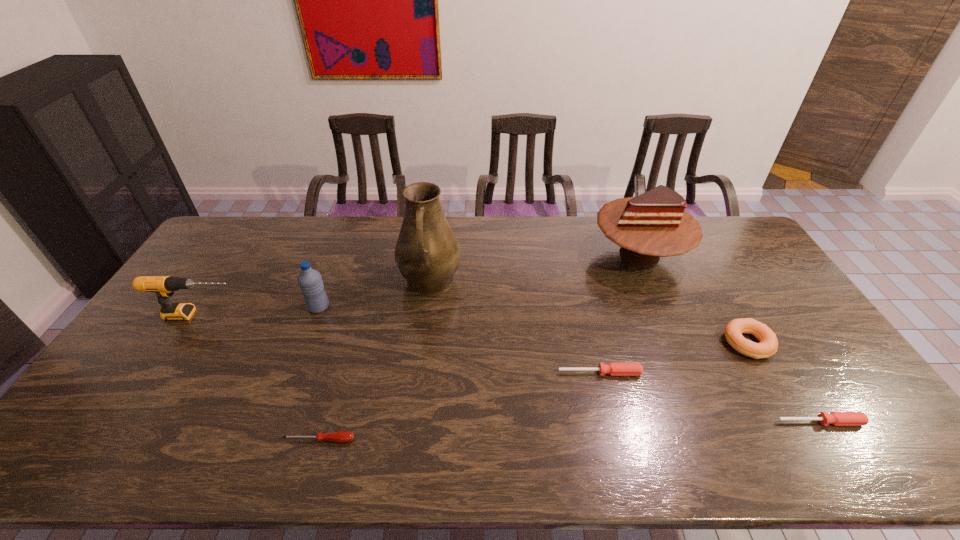
Find the location of a particular element. This screenshot has height=540, width=960. the fourth object from left to right is located at coordinates (427, 253).

Identify the location of the tallest object. Image resolution: width=960 pixels, height=540 pixels. (427, 253).

Identify the location of the second tallest object. (654, 224).

What are the coordinates of `the second object from left to right` in the screenshot? It's located at (x=310, y=282).

Where is `the leftmost object`? The height and width of the screenshot is (540, 960). the leftmost object is located at coordinates (163, 286).

Locate an element on the screen. The image size is (960, 540). drill is located at coordinates (163, 286).

Locate an element on the screen. the fifth tallest object is located at coordinates (733, 331).

Identify the location of the fourth nearest object. click(x=733, y=331).

At what (x,y) coordinates should I click in order to perform the action: click on the sixth farthest object. Please return your answer as a coordinate pair (x, y). Looking at the image, I should click on [x=614, y=369].

Locate an element on the screen. the second screwdriver from left to right is located at coordinates (614, 369).